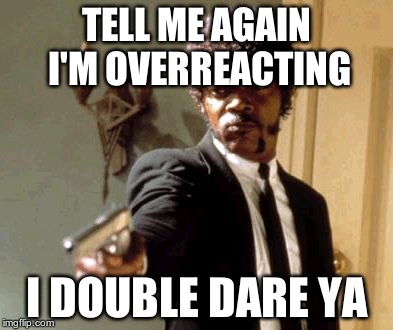
Locate an element on the screen. The width and height of the screenshot is (393, 330). floor is located at coordinates (60, 212).